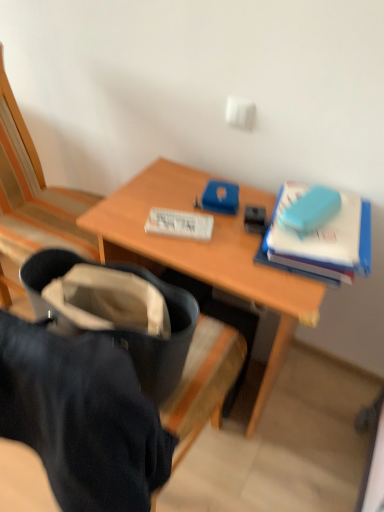
This screenshot has width=384, height=512. I want to click on vacant area that is in front of white paper at center, placed as the first paperback book when sorted from left to right, so click(193, 251).